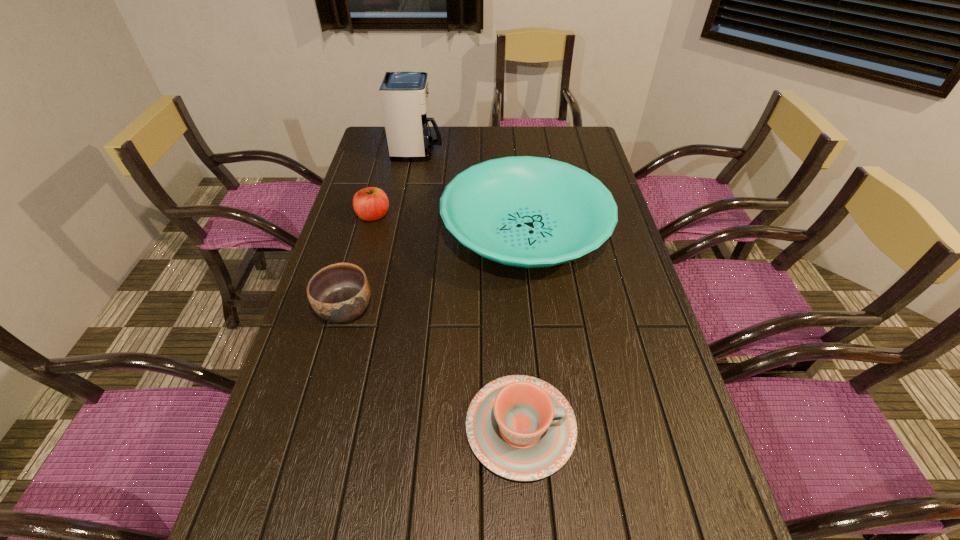
In order to click on free space located 0.260m on the right of the bowl in this screenshot , I will do `click(472, 309)`.

Where is `free space located on the handle side of the nearest object`? Image resolution: width=960 pixels, height=540 pixels. free space located on the handle side of the nearest object is located at coordinates (640, 428).

At what (x,y) coordinates should I click in order to perform the action: click on object that is at the far edge. Please return your answer as a coordinate pair (x, y). The image size is (960, 540). Looking at the image, I should click on point(404,95).

You are a GUI agent. You are given a task and a screenshot of the screen. Output one action in this format:
    pyautogui.click(x=<x>, y=<y>)
    Task: Click on the coffee maker located at the left edge
    The width and height of the screenshot is (960, 540).
    Given the screenshot: What is the action you would take?
    pyautogui.click(x=404, y=95)

Where is `apple that is at the left edge`? This screenshot has width=960, height=540. apple that is at the left edge is located at coordinates (370, 204).

Where is `bowl at the left edge`? bowl at the left edge is located at coordinates 340,292.

Where is `object that is at the right edge`? object that is at the right edge is located at coordinates (531, 212).

This screenshot has height=540, width=960. Find the location of `object that is at the far left corner`. object that is at the far left corner is located at coordinates (404, 95).

You are a GUI agent. You are given a task and a screenshot of the screen. Output one action in this format:
    pyautogui.click(x=<x>, y=<y>)
    Task: Click on the vacant region at the far edge of the desktop
    This screenshot has height=540, width=960.
    Given the screenshot: What is the action you would take?
    pyautogui.click(x=536, y=154)

Find the location of `vacant region at the left edge of the desktop`. vacant region at the left edge of the desktop is located at coordinates (377, 177).